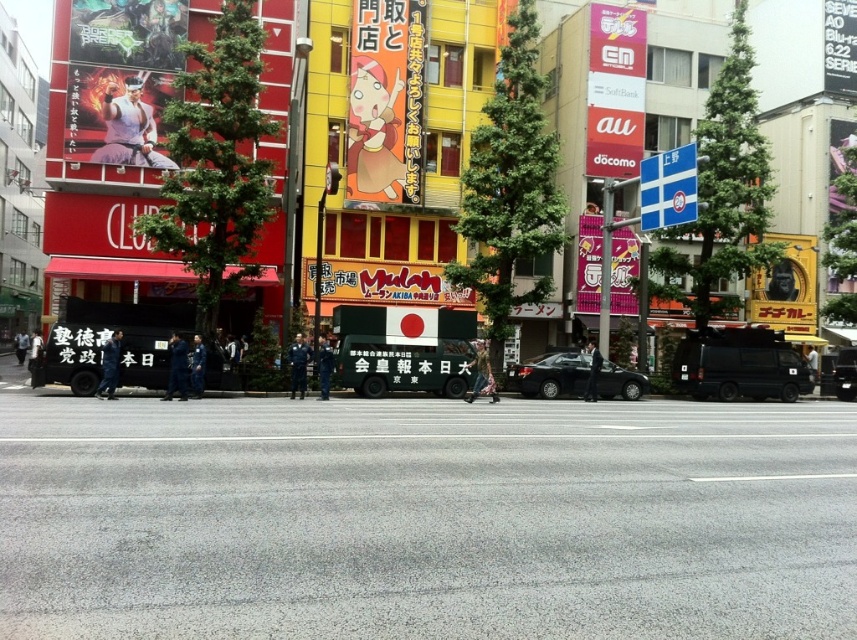
Question: Which point is closer to the camera taking this photo?

Choices:
 (A) (636, 376)
 (B) (615, 266)

Answer: (A)

Question: Which point is closer to the camera taking this photo?

Choices:
 (A) (664, 163)
 (B) (622, 10)
 (C) (562, 385)
 (D) (838, 385)

Answer: (C)

Question: Does matte plastic banner at center appear over yellow matte gorilla head at upper right?

Choices:
 (A) yes
 (B) no

Answer: (A)

Question: Which point is farther from the camera taking this photo?

Choices:
 (A) (838, 385)
 (B) (670, 188)
 (C) (772, 326)

Answer: (C)

Question: Is matte plastic banner at center thinner than metallic green van at center?

Choices:
 (A) yes
 (B) no

Answer: (A)

Question: Does pink matte sign at upper center have a smaller size compared to black matte van at right?

Choices:
 (A) yes
 (B) no

Answer: (A)